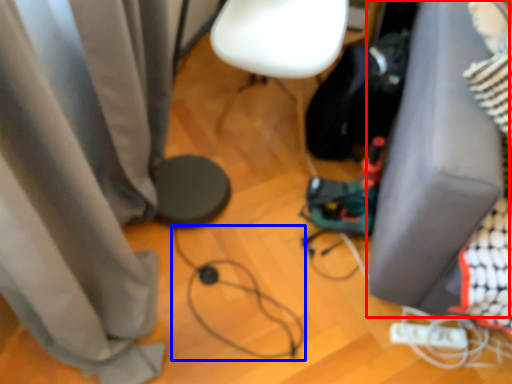
Question: Among these objects, which one is farthest to the camera, furniture (highlighted by a red box) or wire (highlighted by a blue box)?

Choices:
 (A) furniture
 (B) wire

Answer: (B)